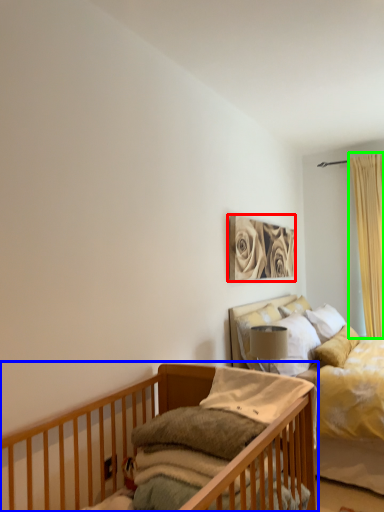
Question: Estimate the real-world distances between objects in this image. Which object is farther from picture frame (highlighted by a red box), infant bed (highlighted by a blue box) or curtain (highlighted by a green box)?

Choices:
 (A) infant bed
 (B) curtain

Answer: (A)